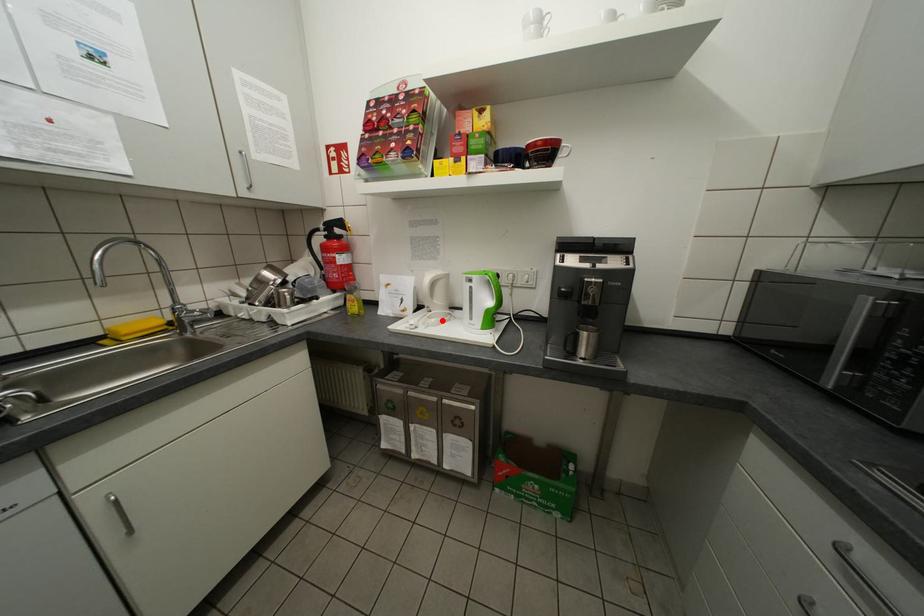
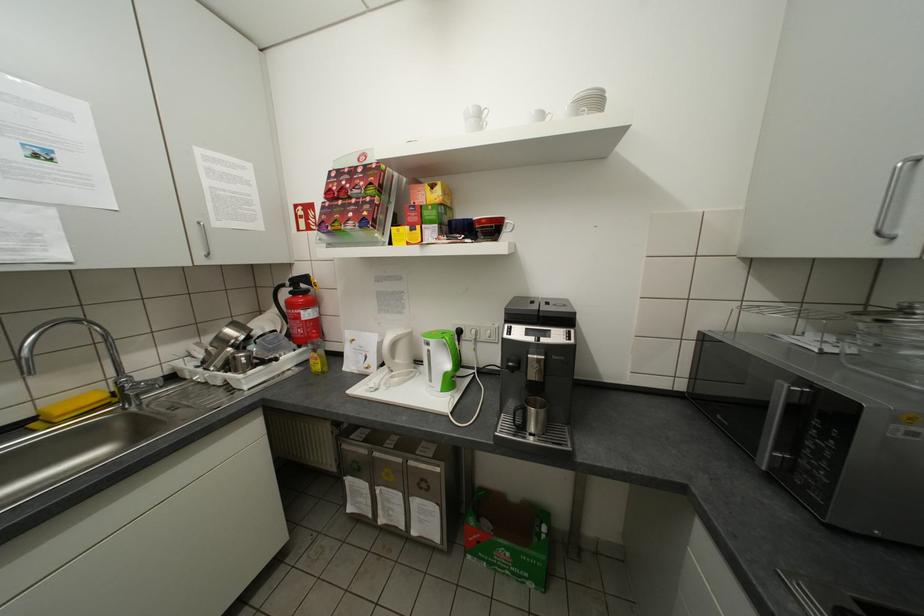
Locate, in the second image, the point that corresponds to the highlighted location in the first image.

(406, 379)